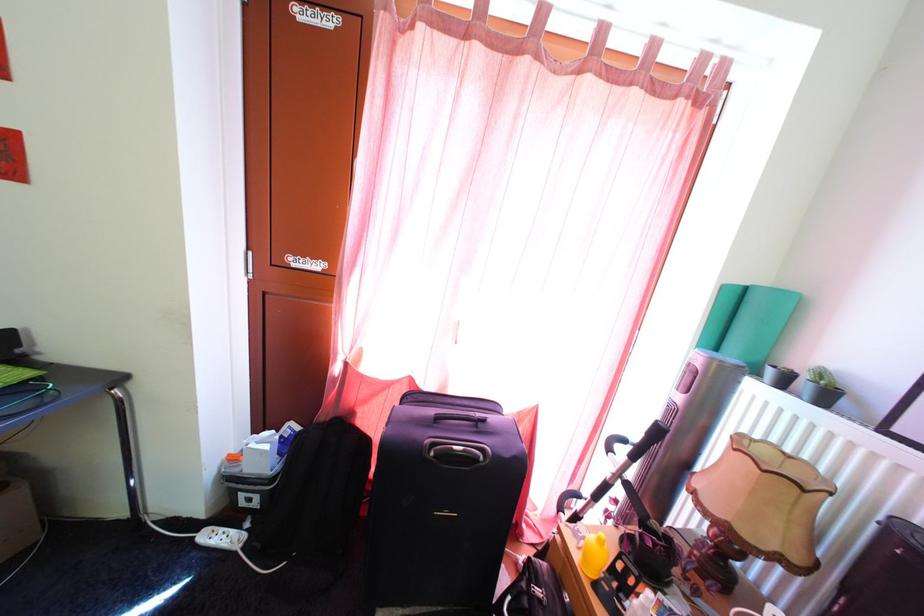
Describe the element at coordinates (756, 511) in the screenshot. The height and width of the screenshot is (616, 924). I see `a scalloped table lamp` at that location.